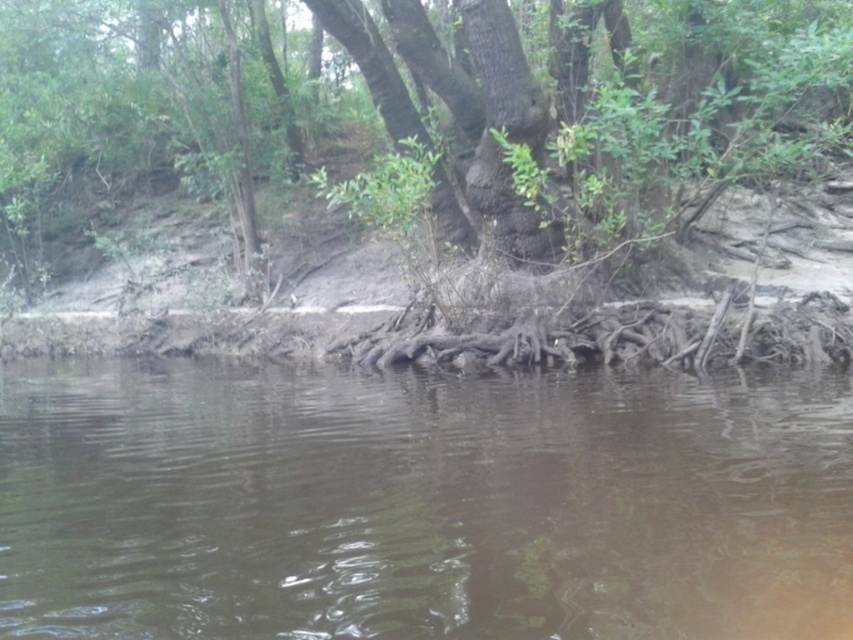
Question: Does brown muddy water at center lie in front of rough bark tree at center?

Choices:
 (A) no
 (B) yes

Answer: (B)

Question: Which object is closer to the camera taking this photo?

Choices:
 (A) brown muddy water at center
 (B) rough bark tree at center

Answer: (A)

Question: Is brown muddy water at center to the right of rough bark tree at center from the viewer's perspective?

Choices:
 (A) yes
 (B) no

Answer: (A)

Question: Among these points, which one is nearest to the camera?

Choices:
 (A) [593, 80]
 (B) [135, 544]

Answer: (B)

Question: Does brown muddy water at center lie behind rough bark tree at center?

Choices:
 (A) no
 (B) yes

Answer: (A)